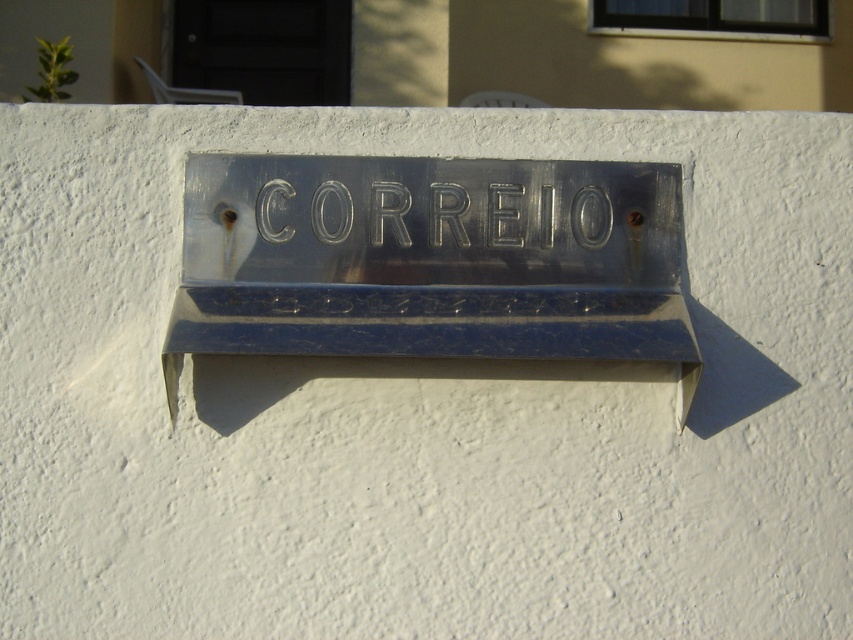
Question: Which object appears farthest from the camera in this image?

Choices:
 (A) metallic blue mailbox at center
 (B) metallic embossed letters at center

Answer: (B)

Question: In this image, where is metallic blue mailbox at center located relative to metallic embossed letters at center?

Choices:
 (A) below
 (B) above

Answer: (A)

Question: Which object is closer to the camera taking this photo?

Choices:
 (A) metallic blue mailbox at center
 (B) metallic embossed letters at center

Answer: (A)

Question: Can you confirm if metallic blue mailbox at center is positioned to the right of metallic embossed letters at center?

Choices:
 (A) yes
 (B) no

Answer: (B)

Question: Is metallic blue mailbox at center closer to the viewer compared to metallic embossed letters at center?

Choices:
 (A) no
 (B) yes

Answer: (B)